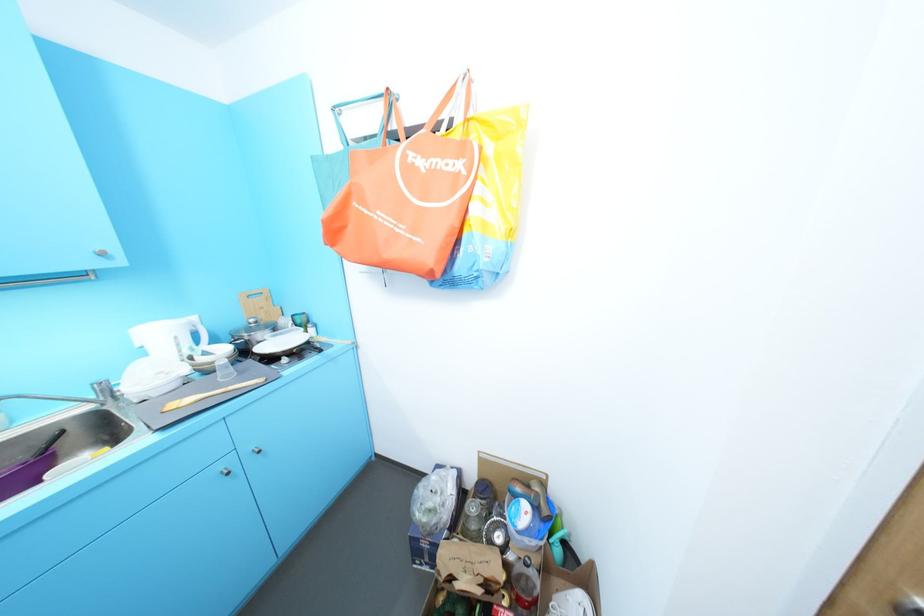
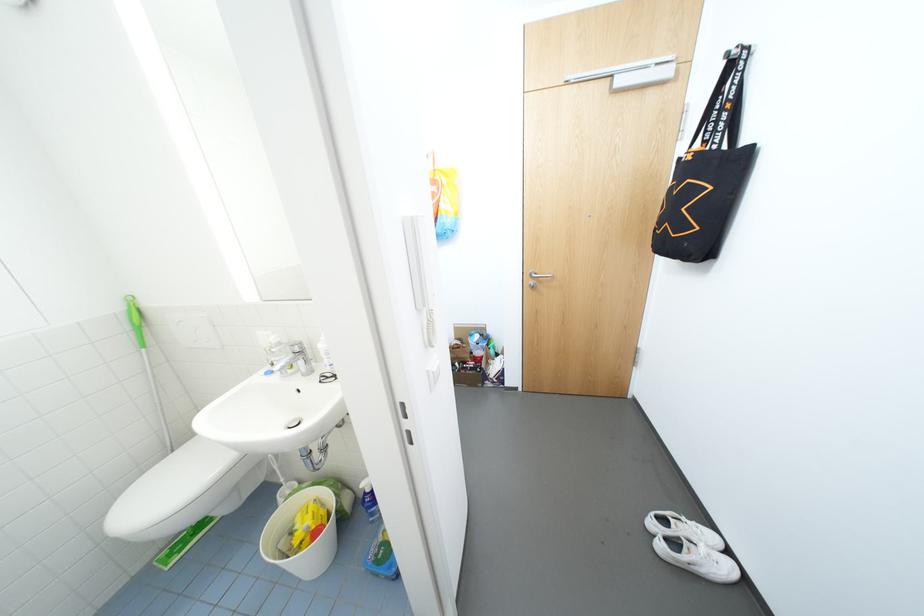
Question: What movement of the cameraman would produce the second image?

Choices:
 (A) Left
 (B) Right
 (C) Forward
 (D) Backward

Answer: (D)